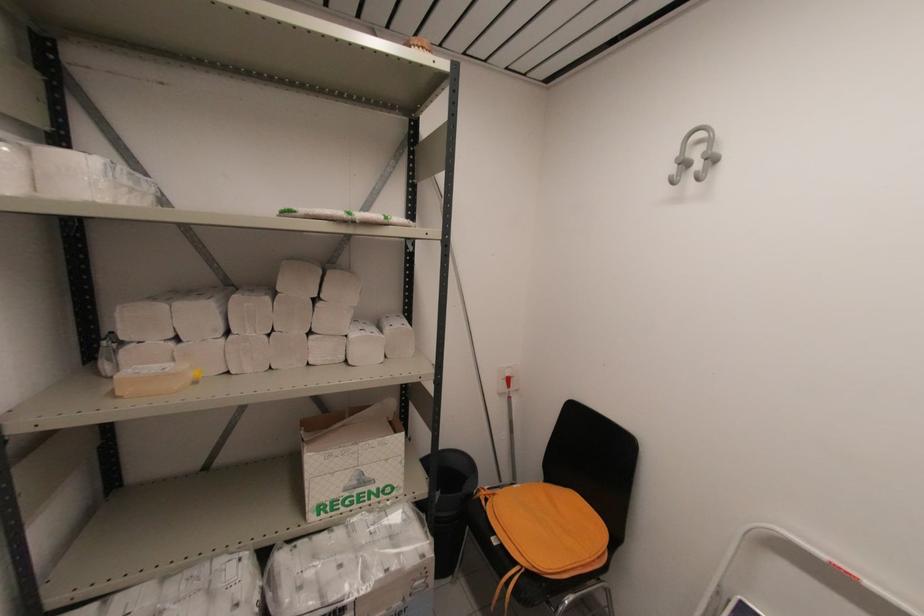
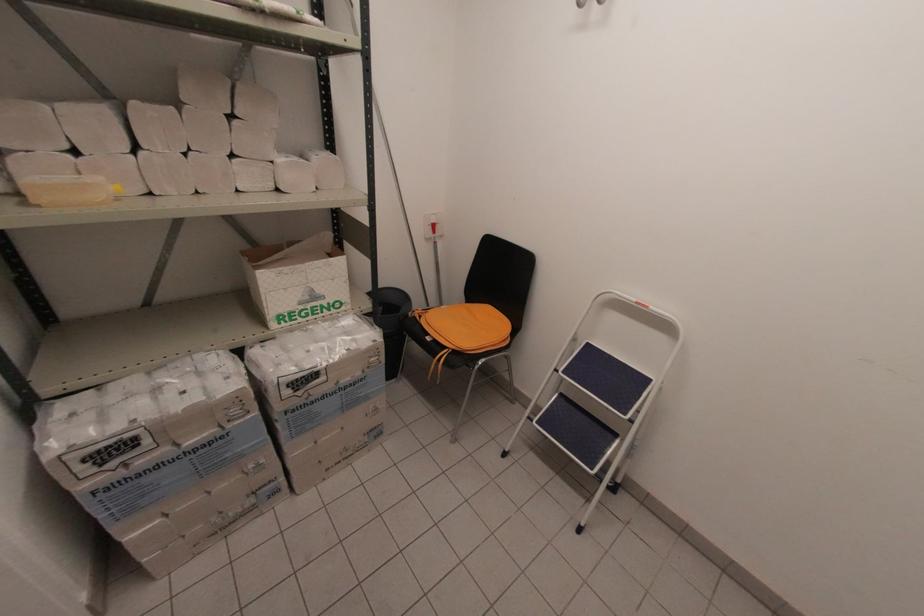
Question: In a continuous first-person perspective shot, in which direction is the camera moving?

Choices:
 (A) Left
 (B) Right
 (C) Forward
 (D) Backward

Answer: (D)